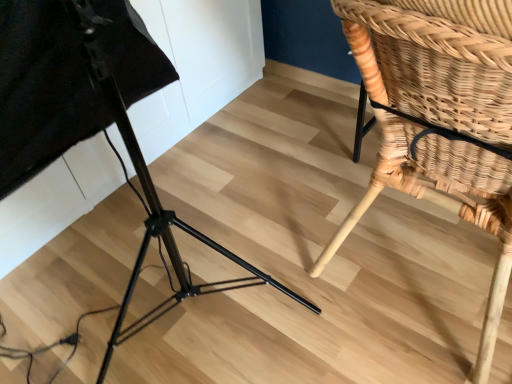
What do you see at coordinates (440, 117) in the screenshot?
I see `woven wood chair at lower right` at bounding box center [440, 117].

I want to click on woven wood chair at lower right, so click(440, 117).

What is the approximate width of woven wood chair at lower right?

woven wood chair at lower right is 64.78 centimeters wide.

You are a GUI agent. You are given a task and a screenshot of the screen. Output one action in this format:
    pyautogui.click(x=<x>, y=<y>)
    Task: Click on the black metal tripod at lower left
    This screenshot has width=512, height=384.
    Given the screenshot: What is the action you would take?
    pyautogui.click(x=152, y=201)

Describe the element at coordinates (152, 201) in the screenshot. I see `black metal tripod at lower left` at that location.

Consider the image. What is the approximate height of black metal tripod at lower left?

black metal tripod at lower left is 37.05 inches in height.

Identify the location of woven wood chair at lower right. (440, 117).

Between black metal tripod at lower left and woven wood chair at lower right, which one appears on the left side from the viewer's perspective?

black metal tripod at lower left is more to the left.

Relative to woven wood chair at lower right, is black metal tripod at lower left in front or behind?

Visually, black metal tripod at lower left is located in front of woven wood chair at lower right.

Considering the points (118, 110) and (492, 101), which point is behind, point (118, 110) or point (492, 101)?

Point (118, 110)

From the image's perspective, between black metal tripod at lower left and woven wood chair at lower right, which one is located above?

woven wood chair at lower right is shown above in the image.

From a real-world perspective, between black metal tripod at lower left and woven wood chair at lower right, who is vertically lower?

From a 3D spatial view, woven wood chair at lower right is below.

Is black metal tripod at lower left wider than woven wood chair at lower right?

Yes, black metal tripod at lower left is wider than woven wood chair at lower right.

Considering the sizes of objects black metal tripod at lower left and woven wood chair at lower right in the image provided, who is shorter, black metal tripod at lower left or woven wood chair at lower right?

woven wood chair at lower right is shorter.

Does black metal tripod at lower left have a smaller size compared to woven wood chair at lower right?

Incorrect, black metal tripod at lower left is not smaller in size than woven wood chair at lower right.

Which is correct: black metal tripod at lower left is inside woven wood chair at lower right, or outside of it?

black metal tripod at lower left is not enclosed by woven wood chair at lower right.

Is black metal tripod at lower left positioned far away from woven wood chair at lower right?

black metal tripod at lower left is near woven wood chair at lower right, not far away.

Is black metal tripod at lower left looking in the opposite direction of woven wood chair at lower right?

black metal tripod at lower left is not turned away from woven wood chair at lower right.

How many degrees apart are the facing directions of black metal tripod at lower left and woven wood chair at lower right?

They differ by 77.9 degrees in their facing directions.

How distant is black metal tripod at lower left from woven wood chair at lower right?

The distance of black metal tripod at lower left from woven wood chair at lower right is 18.03 inches.

Where is `chair below the black metal tripod at lower left (from a real-world perspective)`? The image size is (512, 384). chair below the black metal tripod at lower left (from a real-world perspective) is located at coordinates (440, 117).

From the picture: Between woven wood chair at lower right and black metal tripod at lower left, which one appears on the left side from the viewer's perspective?

From the viewer's perspective, black metal tripod at lower left appears more on the left side.

Considering their positions, is woven wood chair at lower right located in front of or behind black metal tripod at lower left?

Visually, woven wood chair at lower right is located behind black metal tripod at lower left.

Does point (352, 47) appear closer or farther from the camera than point (195, 237)?

Point (352, 47) is positioned closer to the camera compared to point (195, 237).

From the image's perspective, is woven wood chair at lower right positioned above or below black metal tripod at lower left?

woven wood chair at lower right is above black metal tripod at lower left.

From a real-world perspective, is woven wood chair at lower right positioned above or below black metal tripod at lower left?

woven wood chair at lower right is situated lower than black metal tripod at lower left in the real world.

Can you confirm if woven wood chair at lower right is thinner than black metal tripod at lower left?

Yes.

Between woven wood chair at lower right and black metal tripod at lower left, which one has more height?

black metal tripod at lower left is taller.

Between woven wood chair at lower right and black metal tripod at lower left, which one has smaller size?

Smaller between the two is woven wood chair at lower right.

Would you say woven wood chair at lower right contains black metal tripod at lower left?

That's incorrect, black metal tripod at lower left is not inside woven wood chair at lower right.

Are woven wood chair at lower right and black metal tripod at lower left far apart?

No, woven wood chair at lower right is not far away from black metal tripod at lower left.

Is woven wood chair at lower right oriented away from black metal tripod at lower left?

That's right, woven wood chair at lower right is facing away from black metal tripod at lower left.

What's the angular difference between woven wood chair at lower right and black metal tripod at lower left's facing directions?

The angle between the facing direction of woven wood chair at lower right and the facing direction of black metal tripod at lower left is 77.9 degrees.

Image resolution: width=512 pixels, height=384 pixels. I want to click on chair behind the black metal tripod at lower left, so click(440, 117).

I want to click on chair below the black metal tripod at lower left (from a real-world perspective), so click(x=440, y=117).

Where is `chair above the black metal tripod at lower left (from the image's perspective)`? The height and width of the screenshot is (384, 512). chair above the black metal tripod at lower left (from the image's perspective) is located at coordinates (440, 117).